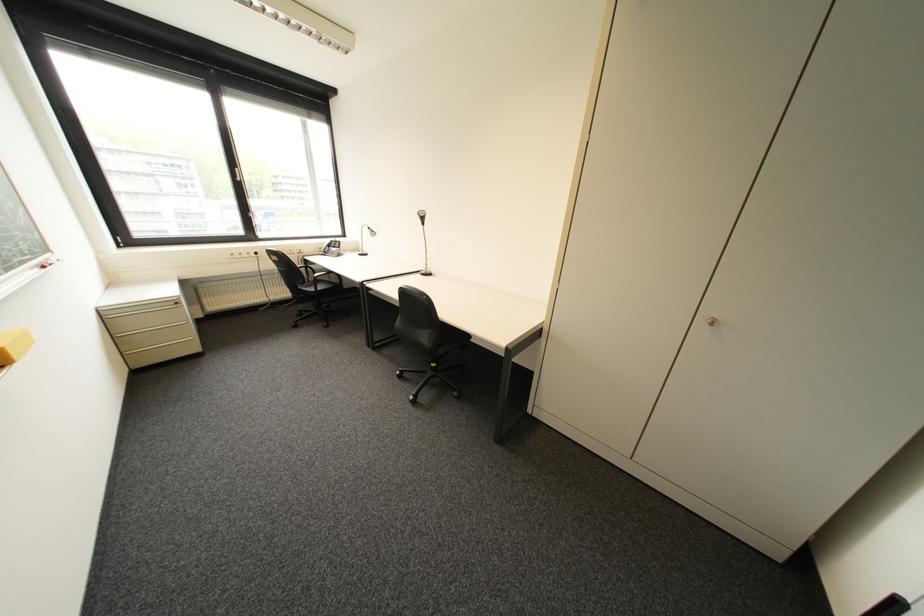
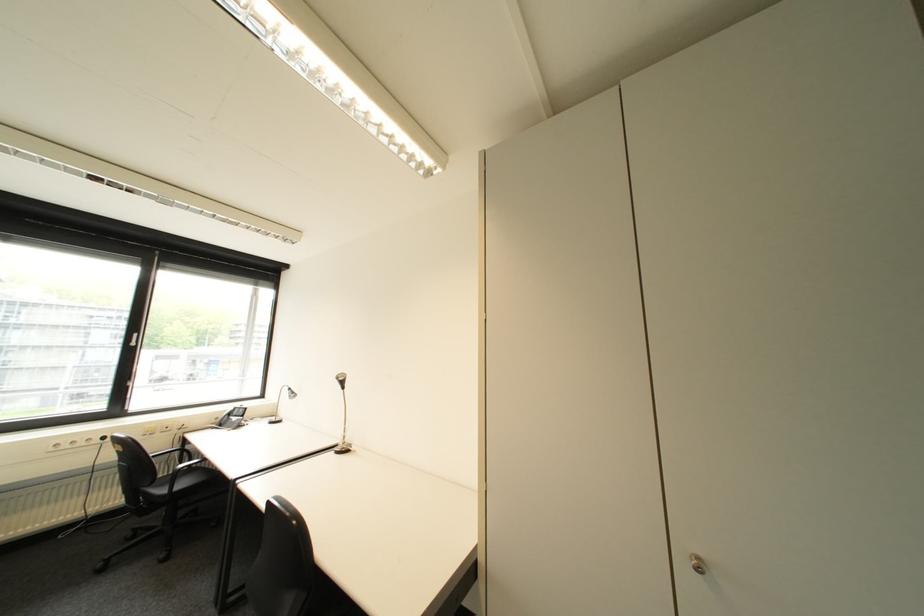
The point at (342, 241) is marked in the first image. Where is the corresponding point in the second image?

(246, 408)